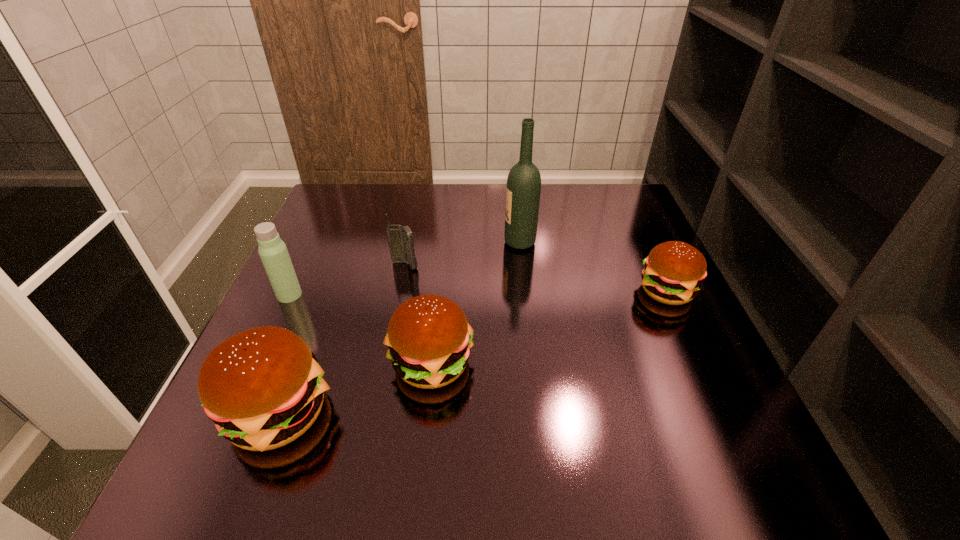
This screenshot has height=540, width=960. I want to click on the leftmost hamburger, so click(263, 388).

Where is `the second hamburger from left to right`? the second hamburger from left to right is located at coordinates point(429,339).

The width and height of the screenshot is (960, 540). Identify the location of the shortest hamburger. (673, 271).

You are a GUI agent. You are given a task and a screenshot of the screen. Output one action in this format:
    pyautogui.click(x=<x>, y=<y>)
    Task: Click on the rightmost hamburger
    Image resolution: width=960 pixels, height=540 pixels.
    Given the screenshot: What is the action you would take?
    pyautogui.click(x=673, y=271)

Locate an element on the screen. The height and width of the screenshot is (540, 960). thermos bottle is located at coordinates (273, 252).

Image resolution: width=960 pixels, height=540 pixels. Identify the location of wine bottle. [523, 190].

Find the location of a particular element. This screenshot has width=960, height=540. the tallest object is located at coordinates (523, 190).

The image size is (960, 540). In order to click on cellular telephone in this screenshot , I will do `click(401, 240)`.

Locate an element on the screen. This screenshot has height=540, width=960. free space located on the back of the leftmost hamburger is located at coordinates (334, 268).

Identify the location of free location located 0.210m on the back of the second tallest hamburger. (442, 268).